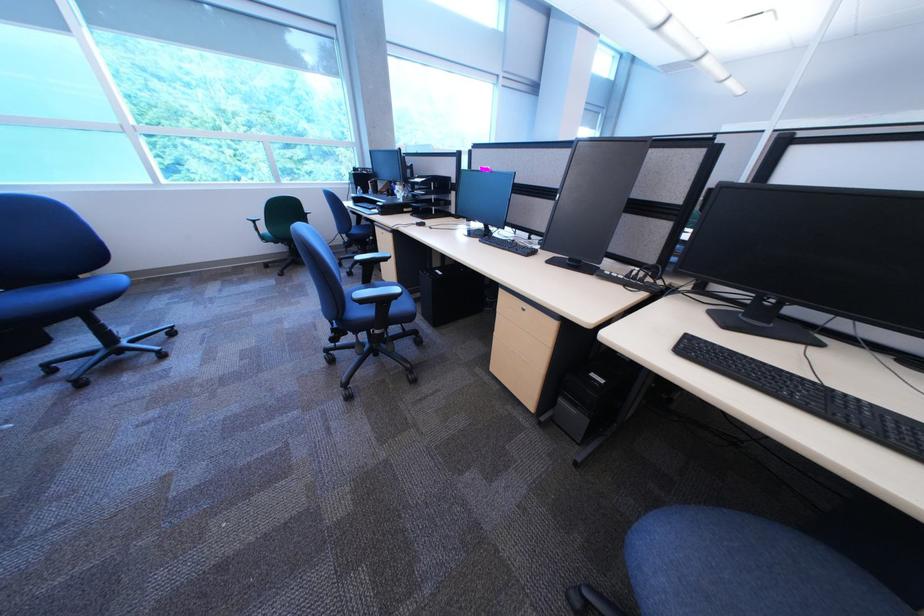
Find the location of a particular element. Image resolution: width=924 pixels, height=616 pixels. black computer mouse is located at coordinates pos(419,223).